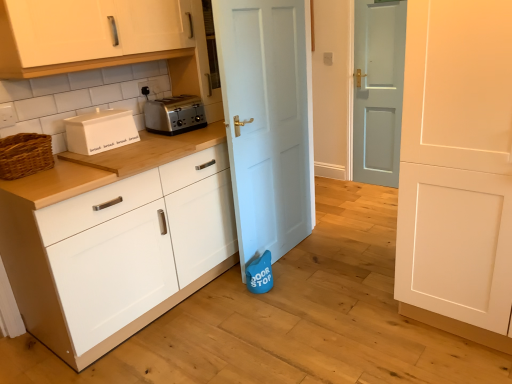
The image size is (512, 384). Identify the location of vacant area that lies between white matte door at right, which is the first door from front to back, and white matte cabinet at center, which appears as the second cabinetry when viewed from the top. (297, 314).